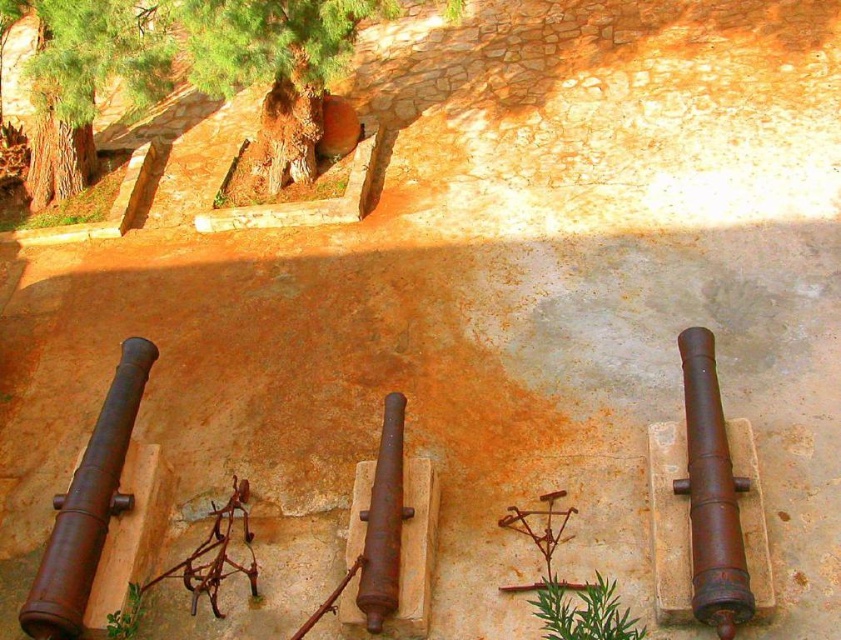
Question: Which object is closer to the camera taking this photo?

Choices:
 (A) rusty metal cannon at right
 (B) brown rough bark tree at upper center
 (C) green leafy plant at lower left

Answer: (A)

Question: Can you confirm if brown rough bark tree at upper center is thinner than rusty metal cannon at right?

Choices:
 (A) yes
 (B) no

Answer: (B)

Question: Which is farther from the green leafy plant at lower center?

Choices:
 (A) rusty metal cannon at right
 (B) green rough bark tree at upper left
 (C) green leafy plant at lower left
 (D) rusty metal cannon at left

Answer: (B)

Question: Which point is closer to the camera?

Choices:
 (A) rusty metal cannon at right
 (B) green leafy plant at lower left
 (C) brown rough bark tree at upper center
 (D) green rough bark tree at upper left

Answer: (A)

Question: Does rusty metal cannon at right appear under green leafy plant at lower left?

Choices:
 (A) no
 (B) yes

Answer: (A)

Question: Does brown rough bark tree at upper center have a lesser width compared to green leafy plant at lower left?

Choices:
 (A) yes
 (B) no

Answer: (B)